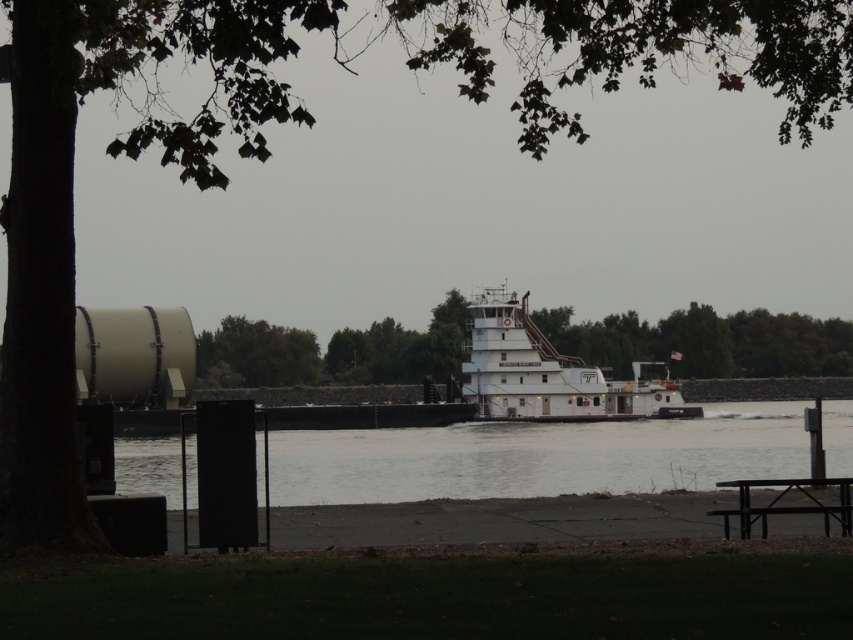
Question: Is clear water at center further to the viewer compared to white matte tugboat at center?

Choices:
 (A) yes
 (B) no

Answer: (B)

Question: Is the position of clear water at center less distant than that of white matte tugboat at center?

Choices:
 (A) no
 (B) yes

Answer: (B)

Question: Estimate the real-world distances between objects in this image. Which object is farther from the clear water at center?

Choices:
 (A) black metal picnic table at lower right
 (B) white matte tugboat at center

Answer: (A)

Question: Does clear water at center appear under white matte tugboat at center?

Choices:
 (A) no
 (B) yes

Answer: (B)

Question: Based on their relative distances, which object is nearer to the white matte tugboat at center?

Choices:
 (A) clear water at center
 (B) black metal picnic table at lower right

Answer: (A)

Question: Which object is farther from the camera taking this photo?

Choices:
 (A) black metal picnic table at lower right
 (B) clear water at center

Answer: (B)